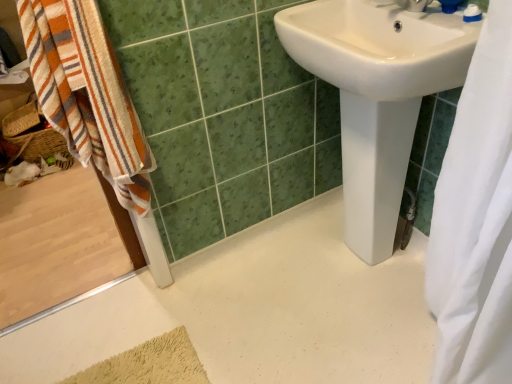
Question: Does point (477, 170) appear closer or farther from the camera than point (477, 16)?

Choices:
 (A) farther
 (B) closer

Answer: (B)

Question: Is white fabric shower curtain at right spatially inside white plastic toothpaste tube at upper right, or outside of it?

Choices:
 (A) outside
 (B) inside

Answer: (A)

Question: Considering the real-world distances, which object is closest to the white plastic toothpaste tube at upper right?

Choices:
 (A) striped cotton towel at left
 (B) white fabric shower curtain at right
 (C) white glossy sink at center
 (D) white glossy faucet at upper right

Answer: (D)

Question: Which is nearer to the white glossy faucet at upper right?

Choices:
 (A) striped cotton towel at left
 (B) white plastic toothpaste tube at upper right
 (C) white glossy sink at center
 (D) white fabric shower curtain at right

Answer: (B)